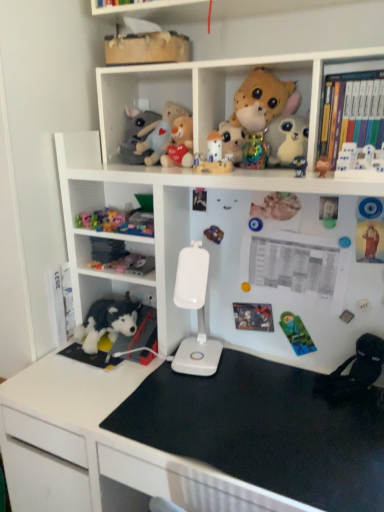
Question: Is matte gray plush at upper center, which ranks as the third toy in top-to-bottom order, to the right of white plastic bookcase at upper center from the viewer's perspective?

Choices:
 (A) yes
 (B) no

Answer: (B)

Question: Does matte gray plush at upper center, the thirteenth toy positioned from the bottom, have a greater width compared to white plastic bookcase at upper center?

Choices:
 (A) no
 (B) yes

Answer: (A)

Question: From a real-world perspective, is matte gray plush at upper center, which ranks as the third toy in top-to-bottom order, positioned over white plastic bookcase at upper center based on gravity?

Choices:
 (A) no
 (B) yes

Answer: (B)

Question: Is matte gray plush at upper center, the thirteenth toy positioned from the bottom, positioned far away from white plastic bookcase at upper center?

Choices:
 (A) no
 (B) yes

Answer: (A)

Question: Is matte gray plush at upper center, which ranks as the third toy in top-to-bottom order, taller than white plastic bookcase at upper center?

Choices:
 (A) no
 (B) yes

Answer: (A)

Question: From a real-world perspective, relative to fluffy plush toy at center, the 12th toy in the bottom-to-top sequence, is metallic shiny toy at center, the 13th toy in the top-to-bottom sequence, vertically above or below?

Choices:
 (A) below
 (B) above

Answer: (A)

Question: Would you say metallic shiny toy at center, the 13th toy in the top-to-bottom sequence, is inside or outside fluffy plush toy at center, placed as the 4th toy when sorted from top to bottom?

Choices:
 (A) outside
 (B) inside

Answer: (A)

Question: Considering the positions of point (218, 243) and point (172, 157), is point (218, 243) closer or farther from the camera than point (172, 157)?

Choices:
 (A) farther
 (B) closer

Answer: (A)

Question: Considering the positions of metallic shiny toy at center, the 13th toy in the top-to-bottom sequence, and fluffy plush toy at center, the 12th toy in the bottom-to-top sequence, in the image, is metallic shiny toy at center, the 13th toy in the top-to-bottom sequence, wider or thinner than fluffy plush toy at center, the 12th toy in the bottom-to-top sequence,?

Choices:
 (A) wide
 (B) thin

Answer: (B)

Question: From the image's perspective, is matte plastic toy at upper center, the 9th toy when ordered from bottom to top, positioned above or below black plush toy at lower left, which is the 14th toy from top to bottom?

Choices:
 (A) below
 (B) above

Answer: (B)

Question: Is matte plastic toy at upper center, the 9th toy when ordered from bottom to top, situated inside black plush toy at lower left, marked as the 2th toy in a bottom-to-top arrangement, or outside?

Choices:
 (A) inside
 (B) outside

Answer: (B)

Question: Is point (296, 175) closer or farther from the camera than point (89, 332)?

Choices:
 (A) closer
 (B) farther

Answer: (A)

Question: Considering the positions of matte plastic toy at upper center, positioned as the 7th toy in top-to-bottom order, and black plush toy at lower left, which is the 14th toy from top to bottom, in the image, is matte plastic toy at upper center, positioned as the 7th toy in top-to-bottom order, bigger or smaller than black plush toy at lower left, which is the 14th toy from top to bottom,?

Choices:
 (A) big
 (B) small

Answer: (B)

Question: From the image's perspective, relative to plush toy at lower left, acting as the fourth toy starting from the bottom, is white plastic lamp at center above or below?

Choices:
 (A) below
 (B) above

Answer: (A)

Question: From a real-world perspective, is white plastic lamp at center physically located above or below plush toy at lower left, which is the twelfth toy from top to bottom?

Choices:
 (A) below
 (B) above

Answer: (A)